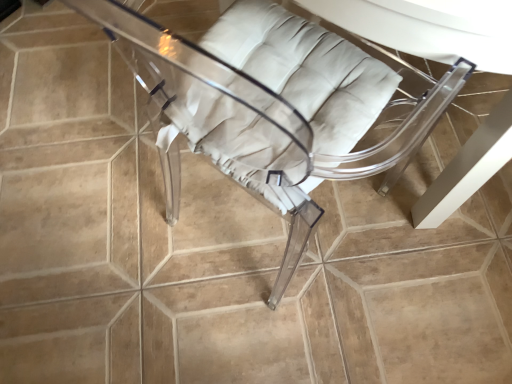
Identify the location of free space to the right of clear acrylic chair at center. The image size is (512, 384). (404, 236).